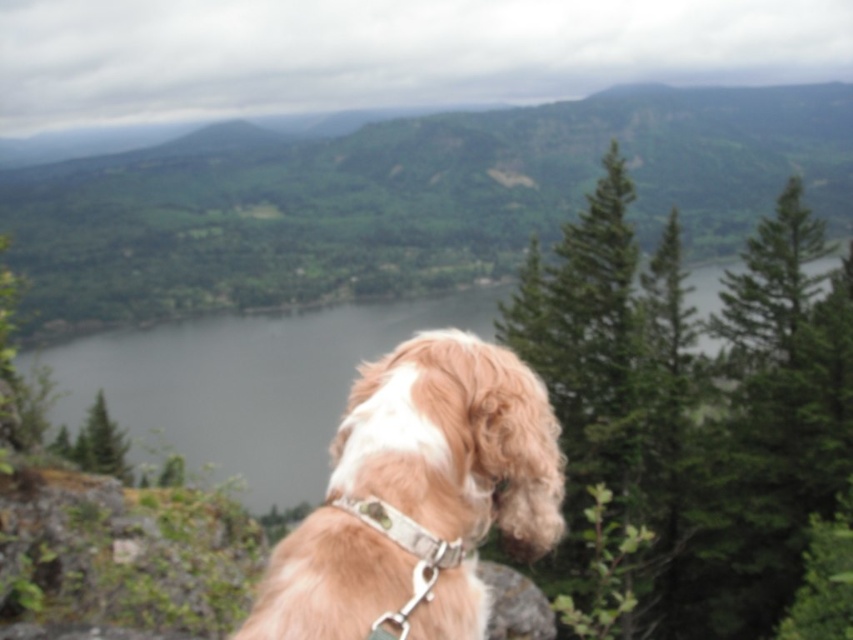
Based on the photo, you are standing at the origin point in the coordinate system of the image. The dog is at the origin. You want to walk to the green water at center. In which direction should you move relative to the dog?

The green water at center is located at coordinate point [245,384]. Since the dog is at the origin, you should move towards the northeast direction to reach the green water at center.

You are a photographer trying to capture the golden fur dog at center and the white fabric neckband at center in a single frame. Based on their positions, which object is closer to the left side of the camera frame?

The white fabric neckband at center is closer to the left side of the camera frame because the golden fur dog at center is positioned to the right of it.

You are a photographer trying to capture the green water at center and the white fabric neckband at center in the same frame. Based on their positions, can you determine which object is wider in the image?

The green water at center might be wider than white fabric neckband at center according to the description.